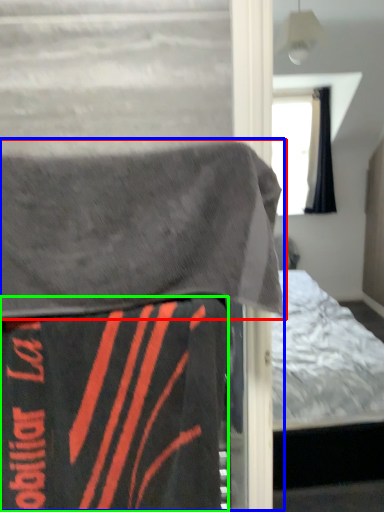
Question: Estimate the real-world distances between objects in this image. Which object is farther from blanket (highlighted by a red box), bed (highlighted by a blue box) or blanket (highlighted by a green box)?

Choices:
 (A) bed
 (B) blanket

Answer: (B)